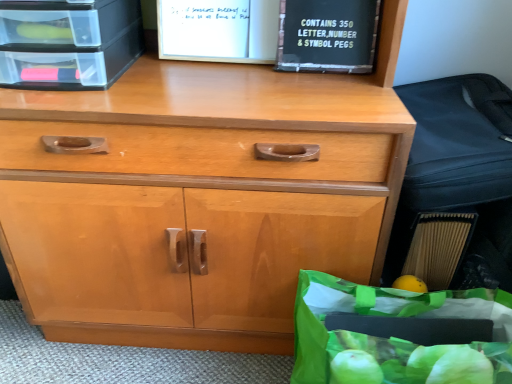
Question: Is green plastic bag at lower right inside black plastic book at upper center?

Choices:
 (A) no
 (B) yes

Answer: (A)

Question: From the image's perspective, is black plastic book at upper center located above green plastic bag at lower right?

Choices:
 (A) yes
 (B) no

Answer: (A)

Question: Considering the relative sizes of black plastic book at upper center and green plastic bag at lower right in the image provided, is black plastic book at upper center bigger than green plastic bag at lower right?

Choices:
 (A) yes
 (B) no

Answer: (B)

Question: Is black plastic book at upper center not inside green plastic bag at lower right?

Choices:
 (A) no
 (B) yes

Answer: (B)

Question: From a real-world perspective, is black plastic book at upper center physically below green plastic bag at lower right?

Choices:
 (A) yes
 (B) no

Answer: (B)

Question: Considering the relative sizes of black plastic book at upper center and green plastic bag at lower right in the image provided, is black plastic book at upper center smaller than green plastic bag at lower right?

Choices:
 (A) no
 (B) yes

Answer: (B)

Question: Can black plastic book at upper center be found inside black plastic sign at upper right?

Choices:
 (A) no
 (B) yes

Answer: (A)

Question: Is black plastic sign at upper right closer to camera compared to black plastic book at upper center?

Choices:
 (A) yes
 (B) no

Answer: (A)

Question: Is black plastic sign at upper right looking in the opposite direction of black plastic book at upper center?

Choices:
 (A) yes
 (B) no

Answer: (A)

Question: From the image's perspective, does black plastic sign at upper right appear lower than black plastic book at upper center?

Choices:
 (A) yes
 (B) no

Answer: (A)

Question: From the image's perspective, is black plastic sign at upper right over black plastic book at upper center?

Choices:
 (A) no
 (B) yes

Answer: (A)

Question: Considering the relative positions of black plastic sign at upper right and black plastic book at upper center in the image provided, is black plastic sign at upper right to the right of black plastic book at upper center from the viewer's perspective?

Choices:
 (A) yes
 (B) no

Answer: (A)

Question: Is clear plastic crate at upper left taller than black plastic sign at upper right?

Choices:
 (A) no
 (B) yes

Answer: (B)